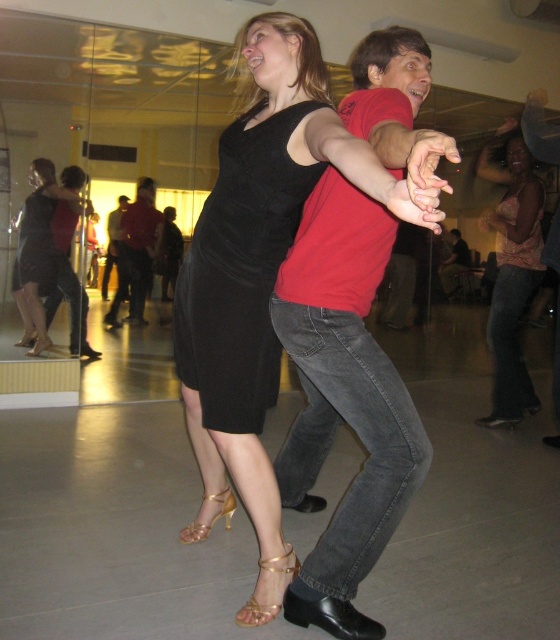
Question: Which point is closer to the camera?

Choices:
 (A) (120, 220)
 (B) (259, 380)

Answer: (B)

Question: Where is matte red t-shirt at center located in relation to black velvet dress at center in the image?

Choices:
 (A) left
 (B) right

Answer: (B)

Question: Can you confirm if matte black dress at center is smaller than red cotton shirt at center?

Choices:
 (A) no
 (B) yes

Answer: (B)

Question: Estimate the real-world distances between objects in this image. Which object is closer to the pink satin blouse at lower right?

Choices:
 (A) matte black dress at center
 (B) matte red t-shirt at center

Answer: (B)

Question: Which point is farther to the camera?

Choices:
 (A) (38, 192)
 (B) (352, 104)

Answer: (A)

Question: Does black velvet dress at center have a greater width compared to pink satin blouse at lower right?

Choices:
 (A) yes
 (B) no

Answer: (B)